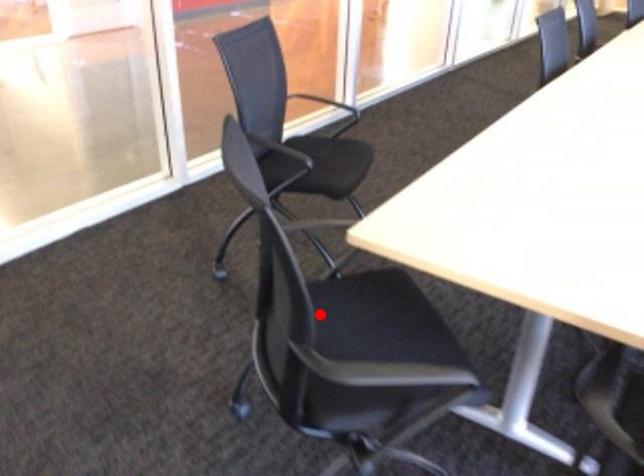
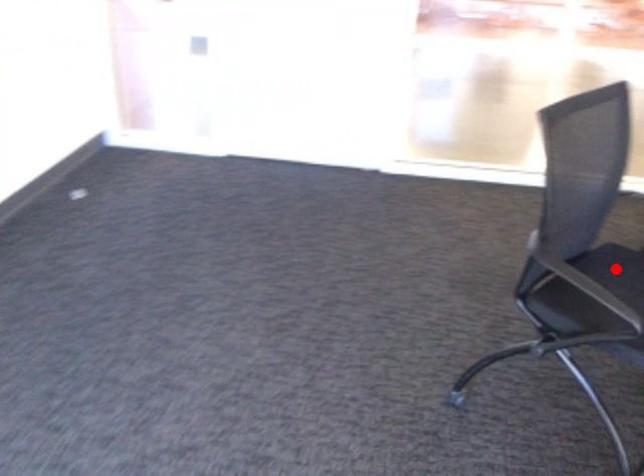
I am providing you with two images of the same scene from different viewpoints. A red point is marked on the first image and another point is marked on the second image. Do the highlighted points in image1 and image2 indicate the same real-world spot?

Yes